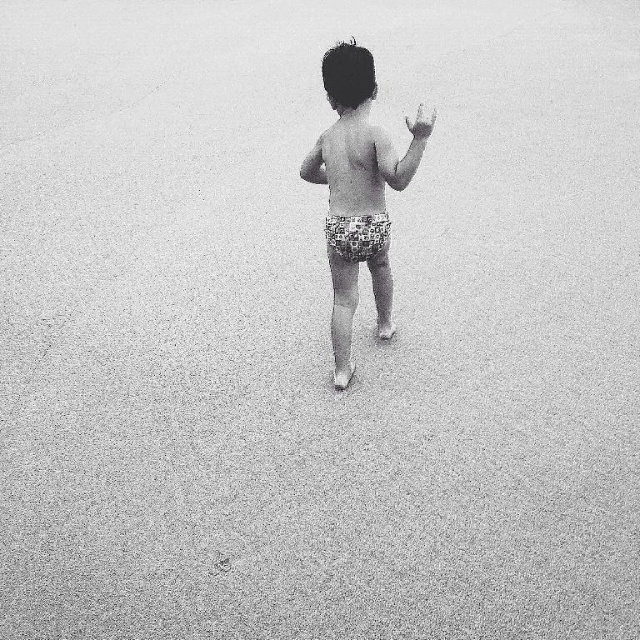
Question: Can you confirm if printed fabric shorts at center is positioned above smooth skin torso at center?

Choices:
 (A) no
 (B) yes

Answer: (A)

Question: Which object is farther from the camera taking this photo?

Choices:
 (A) smooth skin torso at center
 (B) printed fabric shorts at center

Answer: (A)

Question: Can you confirm if printed fabric shorts at center is positioned above smooth skin hand at upper right?

Choices:
 (A) yes
 (B) no

Answer: (B)

Question: Which of these objects is positioned closest to the smooth skin torso at center?

Choices:
 (A) printed fabric shorts at center
 (B) smooth skin hand at upper right

Answer: (A)

Question: Which object is positioned farthest from the printed fabric shorts at center?

Choices:
 (A) smooth skin hand at upper right
 (B) smooth skin torso at center

Answer: (A)

Question: Is printed fabric shorts at center further to the viewer compared to smooth skin hand at upper right?

Choices:
 (A) no
 (B) yes

Answer: (B)